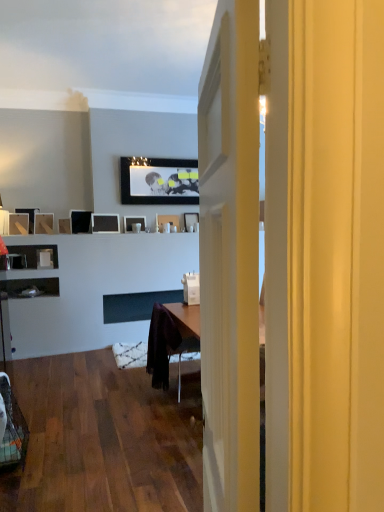
Question: Should I look upward or downward to see matte wood picture frame at left, the 3th picture frame positioned from the left?

Choices:
 (A) up
 (B) down

Answer: (A)

Question: Is matte black picture frame at left, which is the tenth picture frame in right-to-left order, directly adjacent to matte black picture frame at center, which is counted as the 6th picture frame, starting from the right?

Choices:
 (A) yes
 (B) no

Answer: (B)

Question: From a real-world perspective, is matte black picture frame at left, which is the tenth picture frame in right-to-left order, located beneath matte black picture frame at center, which is counted as the 6th picture frame, starting from the right?

Choices:
 (A) yes
 (B) no

Answer: (B)

Question: Is matte black picture frame at left, positioned as the first picture frame in left-to-right order, smaller than matte black picture frame at center, which is counted as the 6th picture frame, starting from the right?

Choices:
 (A) yes
 (B) no

Answer: (B)

Question: Considering the relative positions of matte black picture frame at left, which is the tenth picture frame in right-to-left order, and matte black picture frame at center, which is counted as the 6th picture frame, starting from the right, in the image provided, is matte black picture frame at left, which is the tenth picture frame in right-to-left order, behind matte black picture frame at center, which is counted as the 6th picture frame, starting from the right,?

Choices:
 (A) yes
 (B) no

Answer: (B)

Question: Considering the relative sizes of matte black picture frame at left, which is the tenth picture frame in right-to-left order, and matte black picture frame at center, placed as the fifth picture frame when sorted from left to right, in the image provided, is matte black picture frame at left, which is the tenth picture frame in right-to-left order, bigger than matte black picture frame at center, placed as the fifth picture frame when sorted from left to right,?

Choices:
 (A) no
 (B) yes

Answer: (B)

Question: Can you confirm if matte black picture frame at left, positioned as the first picture frame in left-to-right order, is wider than matte black picture frame at center, which is counted as the 6th picture frame, starting from the right?

Choices:
 (A) no
 (B) yes

Answer: (B)

Question: Considering the relative sizes of matte black picture frame at upper center, which appears as the third picture frame when viewed from the right, and matte black picture frame at center, the sixth picture frame from the left, in the image provided, is matte black picture frame at upper center, which appears as the third picture frame when viewed from the right, smaller than matte black picture frame at center, the sixth picture frame from the left,?

Choices:
 (A) yes
 (B) no

Answer: (B)

Question: Does matte black picture frame at upper center, which appears as the third picture frame when viewed from the right, have a lesser height compared to matte black picture frame at center, the sixth picture frame from the left?

Choices:
 (A) no
 (B) yes

Answer: (A)

Question: Is matte black picture frame at center, the sixth picture frame from the left, at the back of matte black picture frame at upper center, which appears as the third picture frame when viewed from the right?

Choices:
 (A) yes
 (B) no

Answer: (B)

Question: Does matte black picture frame at upper center, which appears as the third picture frame when viewed from the right, come behind matte black picture frame at center, the fifth picture frame when ordered from right to left?

Choices:
 (A) yes
 (B) no

Answer: (A)

Question: From a real-world perspective, is matte black picture frame at upper center, which ranks as the 8th picture frame in left-to-right order, physically above matte black picture frame at center, the sixth picture frame from the left?

Choices:
 (A) yes
 (B) no

Answer: (A)

Question: Does matte black picture frame at upper center, which appears as the third picture frame when viewed from the right, come in front of matte black picture frame at center, the fifth picture frame when ordered from right to left?

Choices:
 (A) no
 (B) yes

Answer: (A)

Question: Does matte wood picture frame at left, the 3th picture frame positioned from the left, lie in front of matte black picture frame at left, positioned as the first picture frame in left-to-right order?

Choices:
 (A) yes
 (B) no

Answer: (A)